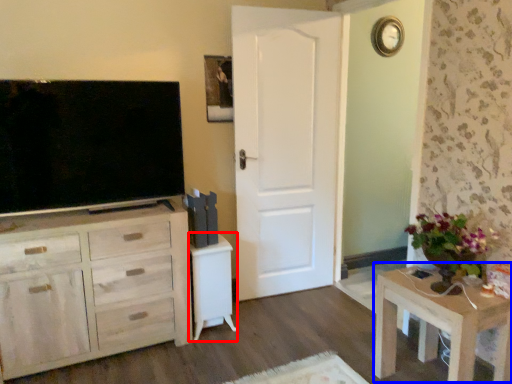
Question: Which object is further to the camera taking this photo, vanity (highlighted by a red box) or table (highlighted by a blue box)?

Choices:
 (A) vanity
 (B) table

Answer: (A)